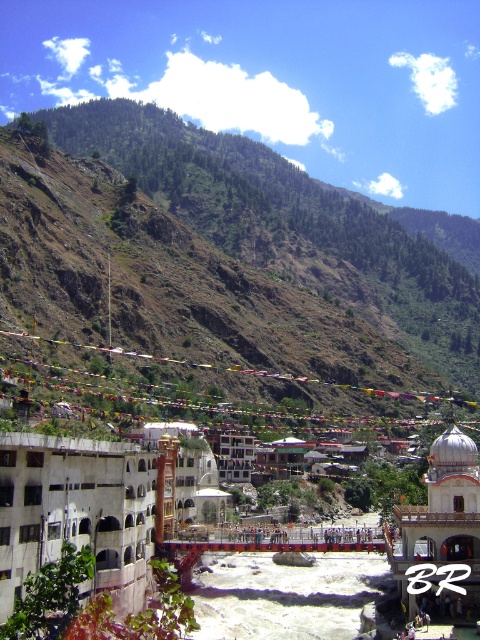
Can you confirm if green grassy hillside at upper center is taller than white stucco building at center?

Yes, green grassy hillside at upper center is taller than white stucco building at center.

Is green grassy hillside at upper center to the left of white stucco building at center from the viewer's perspective?

In fact, green grassy hillside at upper center is to the right of white stucco building at center.

The image size is (480, 640). Describe the element at coordinates (225, 259) in the screenshot. I see `green grassy hillside at upper center` at that location.

The height and width of the screenshot is (640, 480). Identify the location of green grassy hillside at upper center. (225, 259).

Who is higher up, green grassy hillside at upper center or white marble dome at center?

green grassy hillside at upper center

Does point (181, 184) come in front of point (425, 518)?

No, it is not.

Locate an element on the screen. green grassy hillside at upper center is located at coordinates (225, 259).

Can you confirm if white stucco building at center is thinner than white marble dome at center?

No, white stucco building at center is not thinner than white marble dome at center.

Image resolution: width=480 pixels, height=640 pixels. Describe the element at coordinates (76, 513) in the screenshot. I see `white stucco building at center` at that location.

This screenshot has width=480, height=640. What do you see at coordinates (76, 513) in the screenshot?
I see `white stucco building at center` at bounding box center [76, 513].

Where is `white stucco building at center`? The width and height of the screenshot is (480, 640). white stucco building at center is located at coordinates [x=76, y=513].